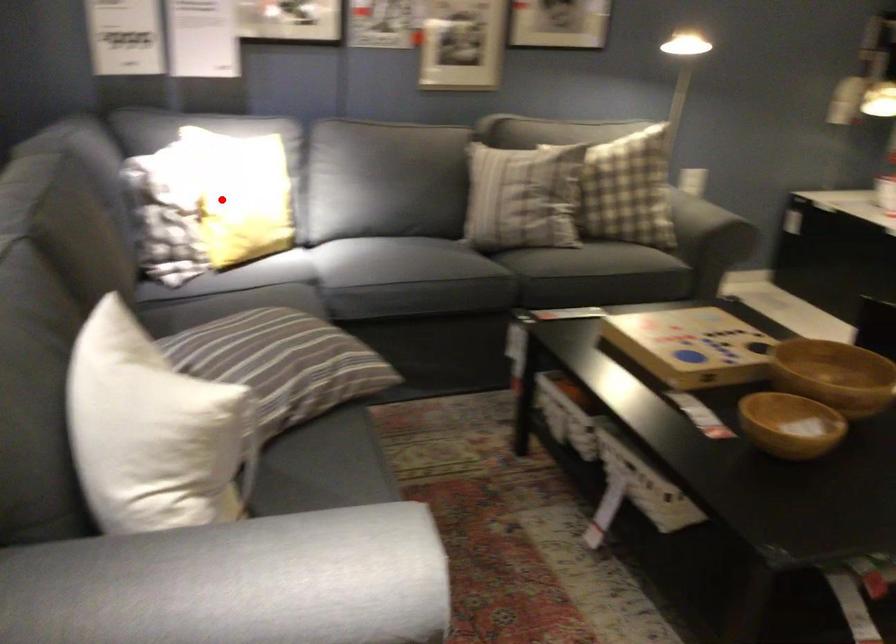
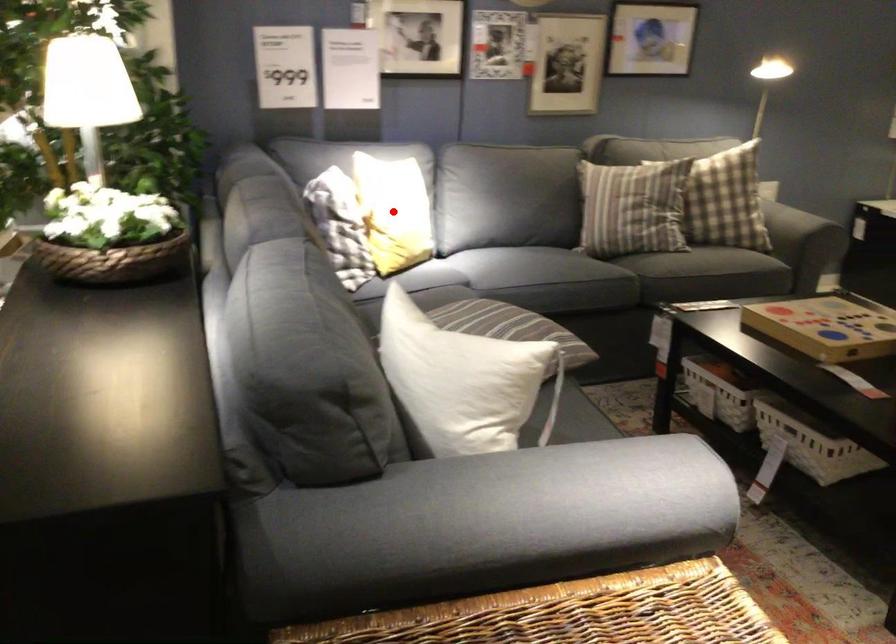
I am providing you with two images of the same scene from different viewpoints. A red point is marked on the first image and another point is marked on the second image. Do the highlighted points in image1 and image2 indicate the same real-world spot?

Yes